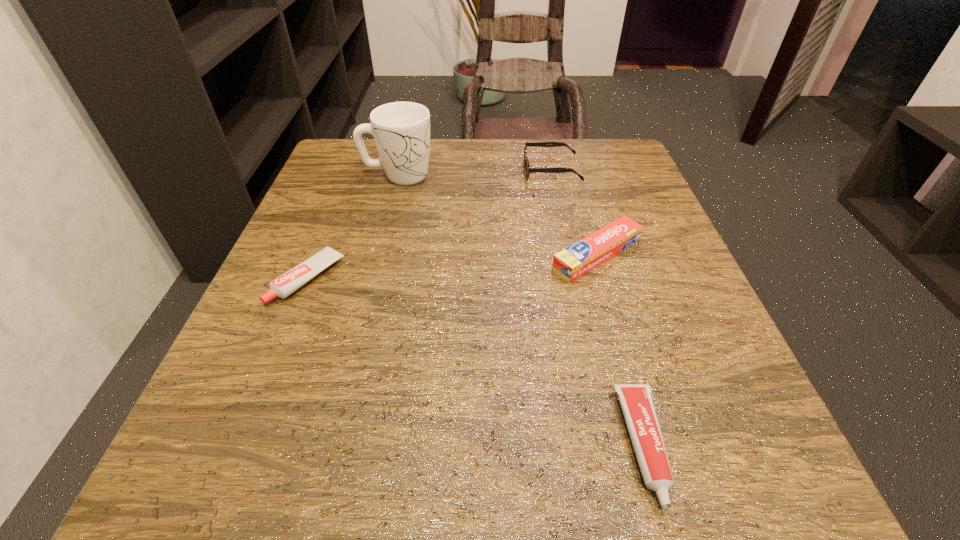
Locate an element on the screen. This screenshot has width=960, height=540. sunglasses located at the far edge is located at coordinates pos(528,169).

Where is `object that is at the near edge`? The image size is (960, 540). object that is at the near edge is located at coordinates (636, 401).

Locate an element on the screen. This screenshot has height=540, width=960. mug that is positioned at the left edge is located at coordinates (401, 130).

Locate an element on the screen. toothpaste that is at the left edge is located at coordinates (283, 286).

Where is `sunglasses that is positioned at the right edge`? This screenshot has height=540, width=960. sunglasses that is positioned at the right edge is located at coordinates (528, 169).

At what (x,y) coordinates should I click in order to perform the action: click on object that is at the far left corner. Please return your answer as a coordinate pair (x, y). Looking at the image, I should click on (401, 130).

In order to click on object located at the far right corner in this screenshot , I will do `click(528, 169)`.

The height and width of the screenshot is (540, 960). In order to click on object that is at the near right corner in this screenshot , I will do `click(636, 401)`.

Image resolution: width=960 pixels, height=540 pixels. In order to click on free space at the far edge of the desktop in this screenshot , I will do `click(522, 174)`.

Locate an element on the screen. free space at the near edge is located at coordinates (410, 517).